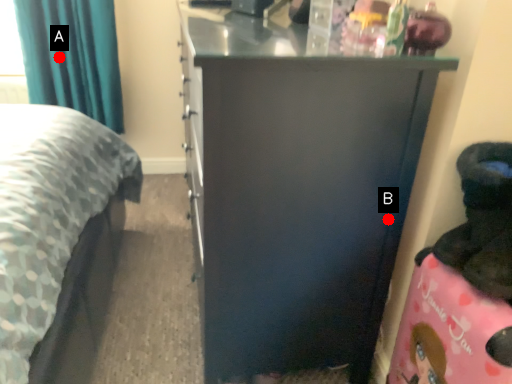
Question: Two points are circled on the image, labeled by A and B beside each circle. Which point is closer to the camera?

Choices:
 (A) A is closer
 (B) B is closer

Answer: (B)